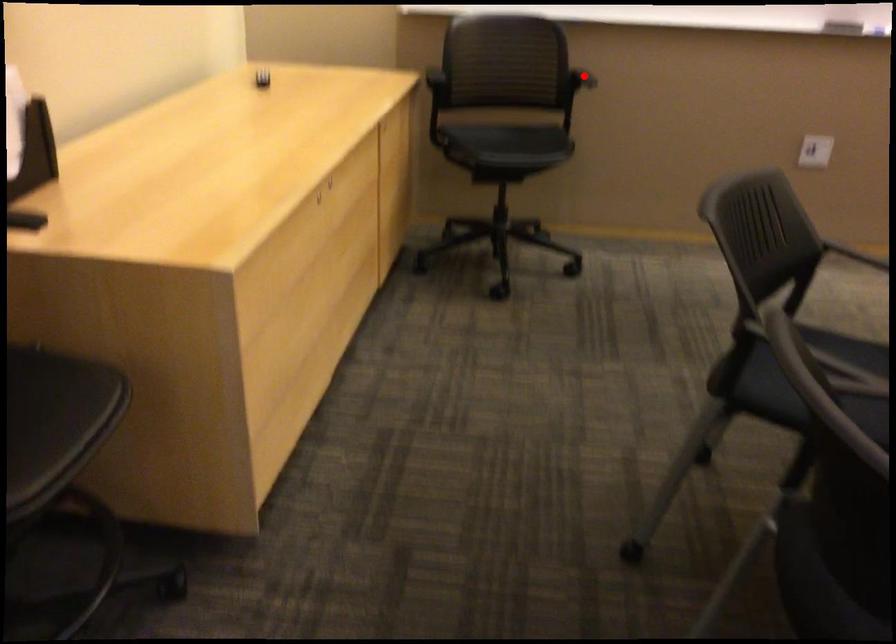
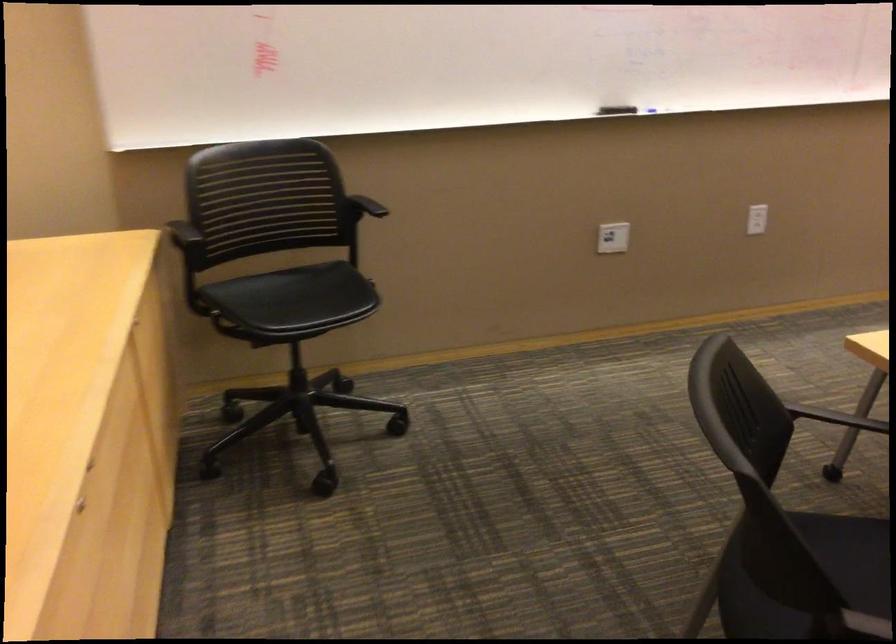
In the second image, find the point that corresponds to the highlighted location in the first image.

(366, 205)